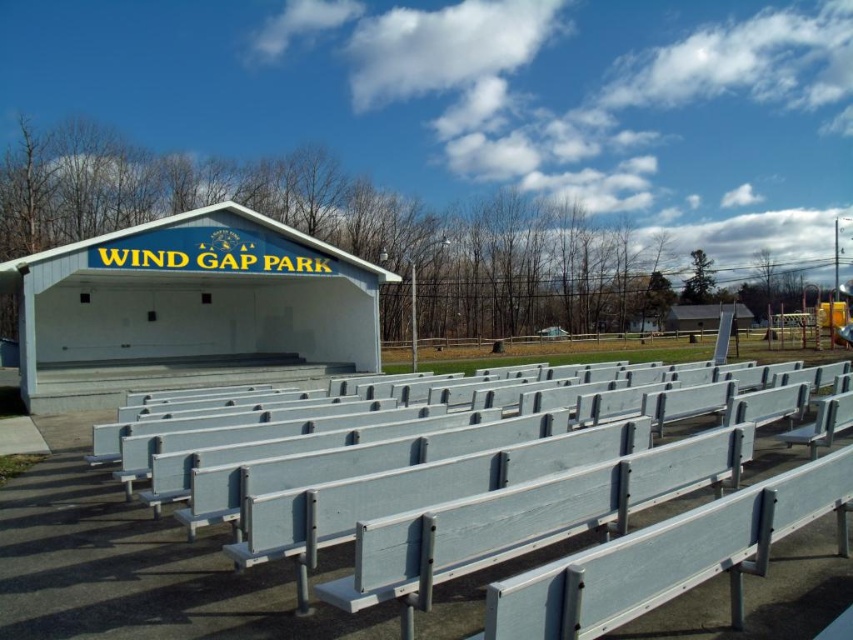
Is point (515, 436) more distant than point (12, 285)?

No, (515, 436) is in front of (12, 285).

Between white painted wood bench at lower center and white matte shelter at upper center, which one is positioned higher?

white matte shelter at upper center

Where is `white painted wood bench at lower center`? white painted wood bench at lower center is located at coordinates (457, 499).

Locate an element on the screen. The image size is (853, 640). white painted wood bench at lower center is located at coordinates (457, 499).